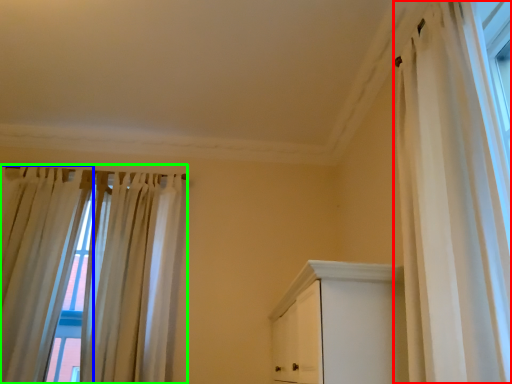
Question: Based on their relative distances, which object is farther from curtain (highlighted by a red box)? Choose from curtain (highlighted by a blue box) and curtain (highlighted by a green box).

Choices:
 (A) curtain
 (B) curtain

Answer: (A)